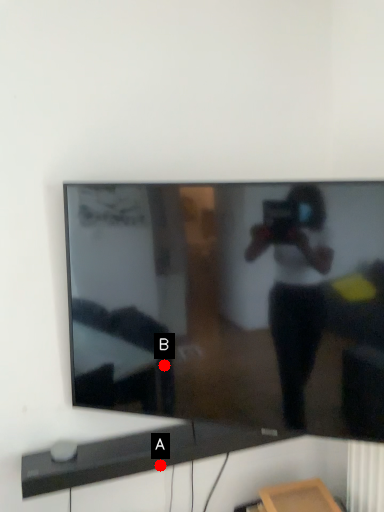
Question: Two points are circled on the image, labeled by A and B beside each circle. Which point is closer to the camera?

Choices:
 (A) A is closer
 (B) B is closer

Answer: (B)